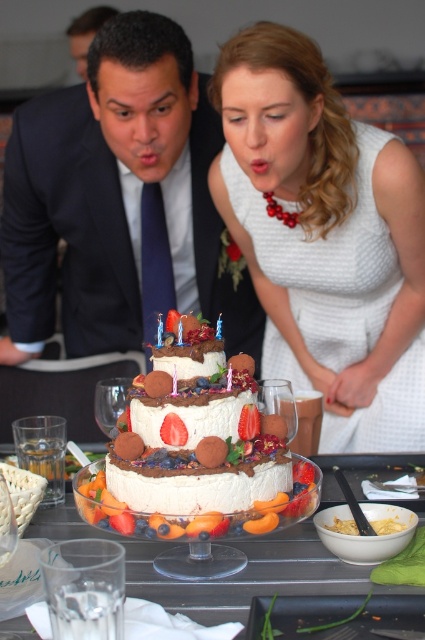
You are a photographer at the event and want to ensure both the white textured dress at center and the white frosted cake at center are clearly visible in the photo. Given their sizes, which one should you focus on first to ensure proper framing?

The white textured dress at center is larger in size than the white frosted cake at center, so you should focus on the white textured dress at center first to ensure proper framing.

Based on the scene description, can you determine which object is closer to the viewer between the matte white dress at center and the white frosted cake at center?

The matte white dress at center is located above the white frosted cake at center, so the matte white dress at center is closer to the viewer.

You are a photographer trying to capture the exact spot where the white textured dress at center was positioned during the cake blowing scene. According to the coordinates provided, where should you place your camera to align with the dress?

The white textured dress at center is located at coordinates point [325,237], so you should position your camera at those coordinates to align with the dress.